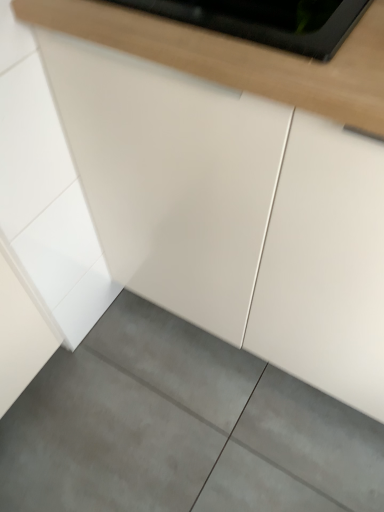
Question: Is the position of gray concrete floor at lower center more distant than that of white glossy countertop at upper center?

Choices:
 (A) no
 (B) yes

Answer: (B)

Question: Is gray concrete floor at lower center at the right side of white glossy countertop at upper center?

Choices:
 (A) yes
 (B) no

Answer: (B)

Question: Can you confirm if gray concrete floor at lower center is positioned to the left of white glossy countertop at upper center?

Choices:
 (A) yes
 (B) no

Answer: (A)

Question: Can you confirm if gray concrete floor at lower center is wider than white glossy countertop at upper center?

Choices:
 (A) yes
 (B) no

Answer: (A)

Question: Can you confirm if gray concrete floor at lower center is thinner than white glossy countertop at upper center?

Choices:
 (A) no
 (B) yes

Answer: (A)

Question: Is white glossy countertop at upper center at the back of gray concrete floor at lower center?

Choices:
 (A) yes
 (B) no

Answer: (B)

Question: From the image's perspective, is white glossy countertop at upper center on top of gray concrete floor at lower center?

Choices:
 (A) yes
 (B) no

Answer: (A)

Question: Considering the relative sizes of white glossy countertop at upper center and gray concrete floor at lower center in the image provided, is white glossy countertop at upper center bigger than gray concrete floor at lower center?

Choices:
 (A) yes
 (B) no

Answer: (B)

Question: Is white glossy countertop at upper center next to gray concrete floor at lower center?

Choices:
 (A) yes
 (B) no

Answer: (B)

Question: From the image's perspective, is white glossy countertop at upper center beneath gray concrete floor at lower center?

Choices:
 (A) no
 (B) yes

Answer: (A)

Question: Is white glossy countertop at upper center behind gray concrete floor at lower center?

Choices:
 (A) no
 (B) yes

Answer: (A)

Question: Is white glossy countertop at upper center wider than gray concrete floor at lower center?

Choices:
 (A) no
 (B) yes

Answer: (A)

Question: Is gray concrete floor at lower center in front of or behind white glossy countertop at upper center in the image?

Choices:
 (A) front
 (B) behind

Answer: (B)